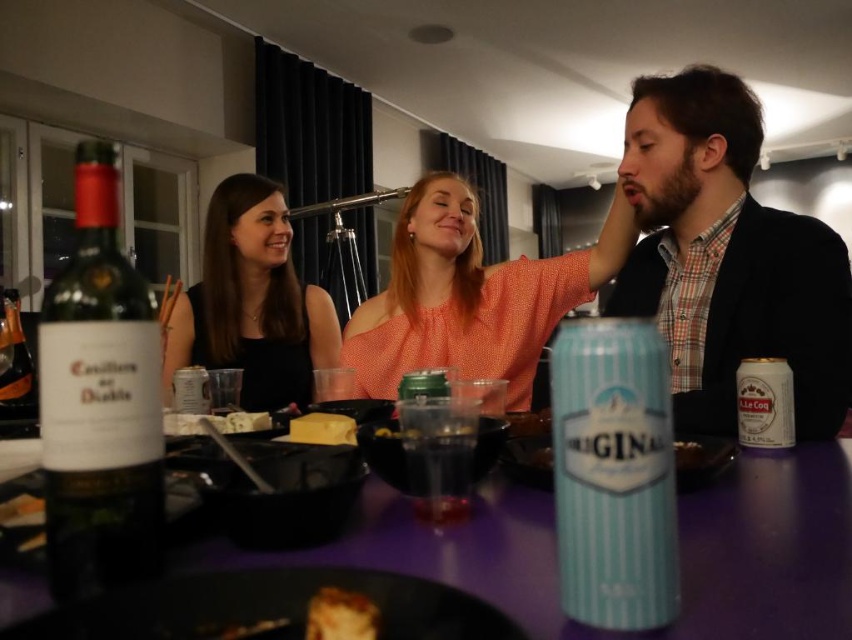
What object is located at the coordinates point (680, 548) in the image?

The point (680, 548) indicates the purple glossy table at center.

You are a guest at this dinner party and want to reach for the yellow cheese at center without touching the orange dotted blouse at center. Is this possible?

The orange dotted blouse at center is further to the viewer than the yellow cheese at center, so you can reach the yellow cheese at center without touching the orange dotted blouse at center by moving around it.